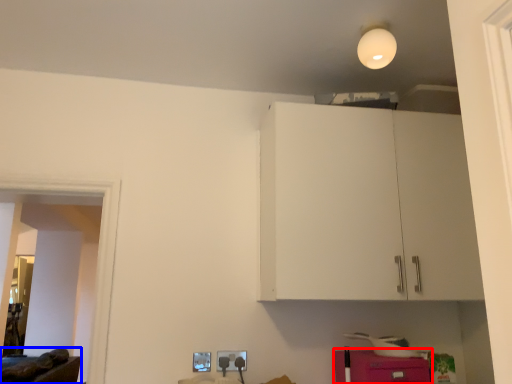
Question: Among these objects, which one is nearest to the camera, cabinetry (highlighted by a red box) or furniture (highlighted by a blue box)?

Choices:
 (A) cabinetry
 (B) furniture

Answer: (A)